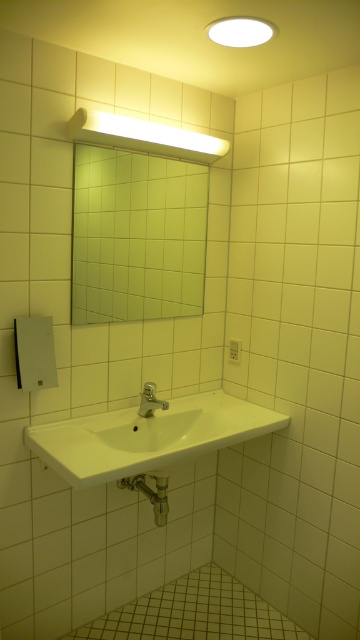
Question: Can you confirm if green tile mirror at upper center is thinner than silver metallic faucet at sink center?

Choices:
 (A) no
 (B) yes

Answer: (A)

Question: Is green tile mirror at upper center positioned behind silver metallic faucet at sink center?

Choices:
 (A) yes
 (B) no

Answer: (B)

Question: Which is farther from the green tile mirror at upper center?

Choices:
 (A) silver metallic faucet at sink center
 (B) white glossy sink at center

Answer: (B)

Question: Which object is positioned closest to the green tile mirror at upper center?

Choices:
 (A) silver metallic faucet at sink center
 (B) white glossy sink at center

Answer: (A)

Question: Which object appears closest to the camera in this image?

Choices:
 (A) white glossy sink at center
 (B) silver metallic faucet at sink center
 (C) green tile mirror at upper center

Answer: (A)

Question: Can you confirm if green tile mirror at upper center is positioned above silver metallic faucet at sink center?

Choices:
 (A) yes
 (B) no

Answer: (A)